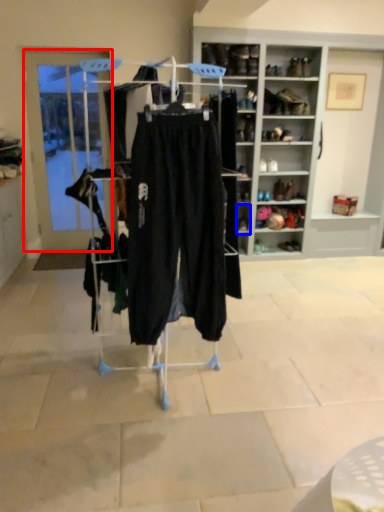
Question: Which object appears farthest to the camera in this image, door (highlighted by a red box) or shelf (highlighted by a blue box)?

Choices:
 (A) door
 (B) shelf

Answer: (B)